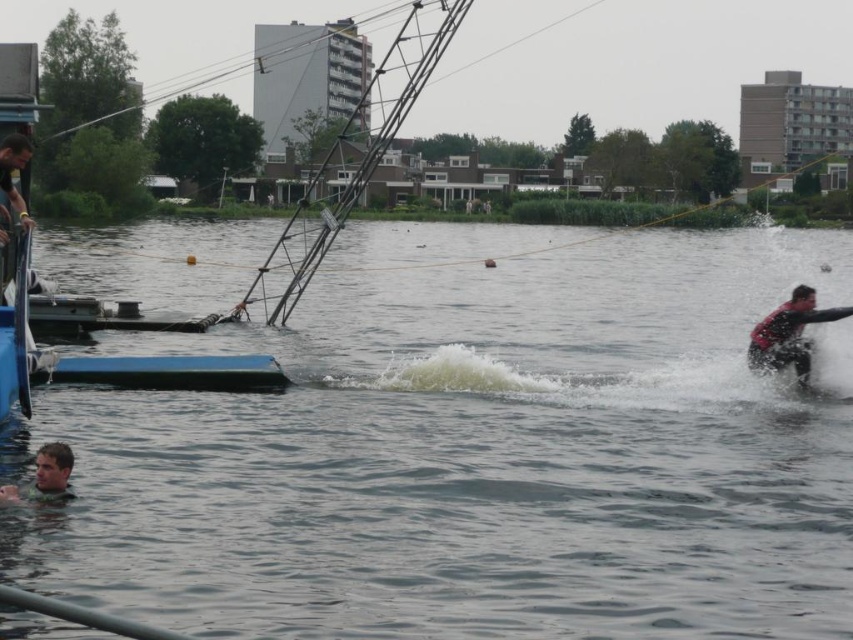
You are a safety inspector checking the water activity setup. You notice the clear water at lower left and the smooth skin head at lower left. Based on their positions, which one is higher from the water surface?

The clear water at lower left is taller than smooth skin head at lower left, so the clear water at lower left is higher from the water surface.

You are a safety inspector evaluating the setup for a wakeboarding event. You notice the clear water at lower left and the smooth skin head at lower left. Based on their positions, which one is more likely to be in the direct path of the wakeboarder during their run?

The clear water at lower left is wider than the smooth skin head at lower left, so it is more likely to be in the direct path of the wakeboarder during their run.

You are a safety inspector checking the setup for a wakeboarding event. The safety guidelines require that the clear water at lower left must be at least twice as wide as the red matte life vest at right for safe operation. Based on the scene provided, can the event proceed safely?

The clear water at lower left might be wider than red matte life vest at right, but since the exact width comparison isn not confirmed, the event should not proceed until measurements confirm the water is sufficiently wide.